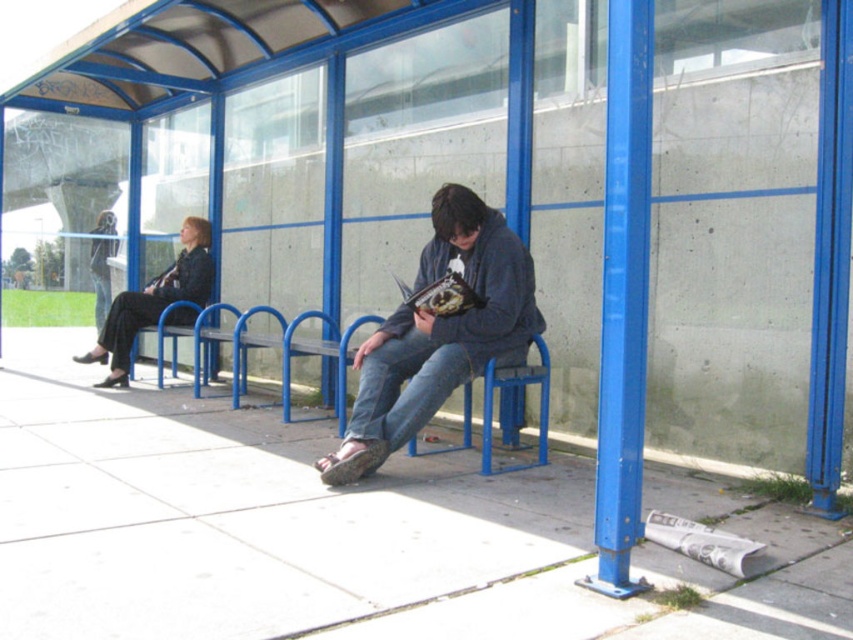
Question: Which point appears closest to the camera in this image?

Choices:
 (A) (202, 337)
 (B) (102, 317)
 (C) (173, 291)
 (D) (532, 296)

Answer: (D)

Question: Considering the real-world distances, which object is closest to the black leather jacket at left?

Choices:
 (A) denim jeans at center
 (B) dark blue jeans at center

Answer: (B)

Question: Can you confirm if denim jeans at center is thinner than dark blue jeans at center?

Choices:
 (A) no
 (B) yes

Answer: (A)

Question: Is blue metal bench at center to the left of dark blue jeans at center from the viewer's perspective?

Choices:
 (A) no
 (B) yes

Answer: (A)

Question: Which point is farther to the camera?

Choices:
 (A) (361, 416)
 (B) (215, 358)
 (C) (158, 280)
 (D) (109, 234)

Answer: (D)

Question: Does denim jeans at center appear on the left side of black leather jacket at left?

Choices:
 (A) no
 (B) yes

Answer: (A)